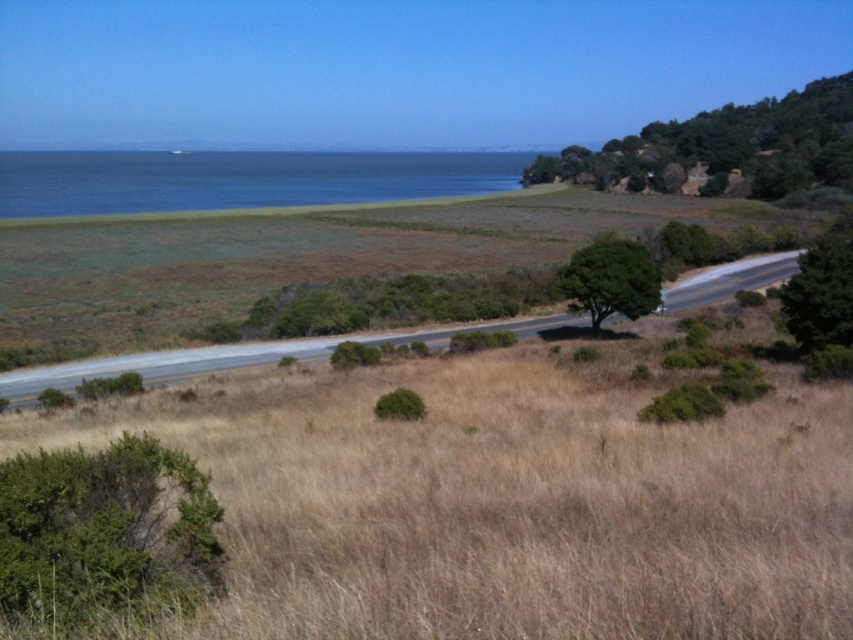
Question: Does green leafy bush at lower left have a lesser width compared to green leafy tree at center?

Choices:
 (A) no
 (B) yes

Answer: (B)

Question: Which of the following is the farthest from the observer?

Choices:
 (A) green leafy tree at right
 (B) blue water at center
 (C) green leafy tree at center
 (D) green leafy tree at upper right

Answer: (D)

Question: Which of the following is the closest to the observer?

Choices:
 (A) blue water at center
 (B) green leafy tree at right
 (C) green leafy bush at lower left

Answer: (C)

Question: Among these objects, which one is nearest to the camera?

Choices:
 (A) green leafy bush at lower left
 (B) blue water at center

Answer: (A)

Question: Is green leafy tree at upper right below green leafy tree at right?

Choices:
 (A) no
 (B) yes

Answer: (A)

Question: Can you confirm if asphalt road at center is smaller than green leafy tree at right?

Choices:
 (A) no
 (B) yes

Answer: (B)